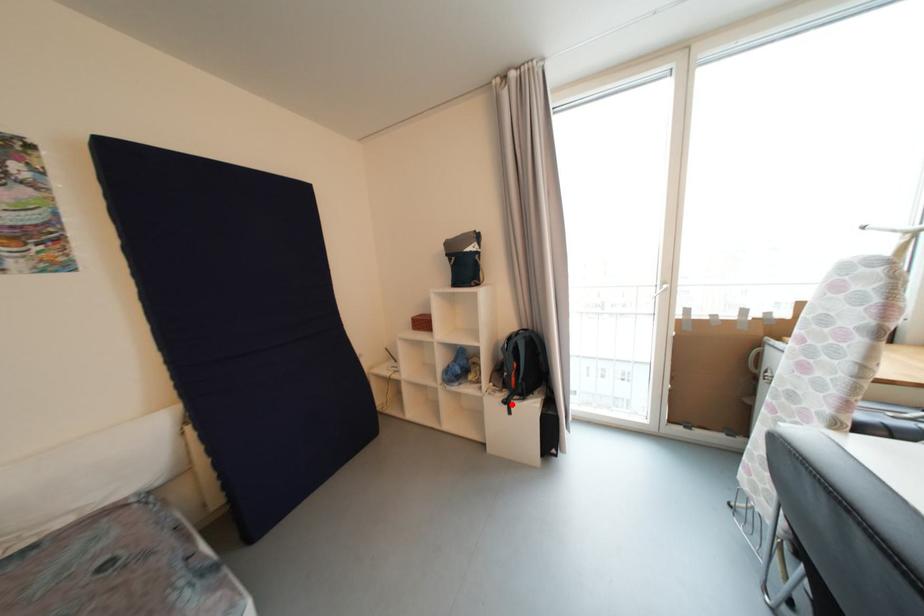
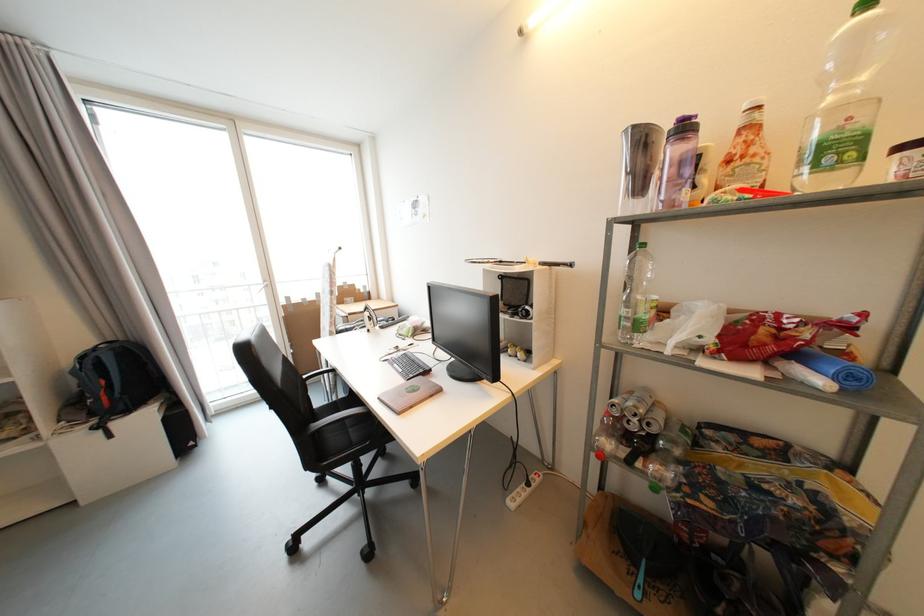
In the second image, find the point that corresponds to the highlighted location in the first image.

(104, 429)